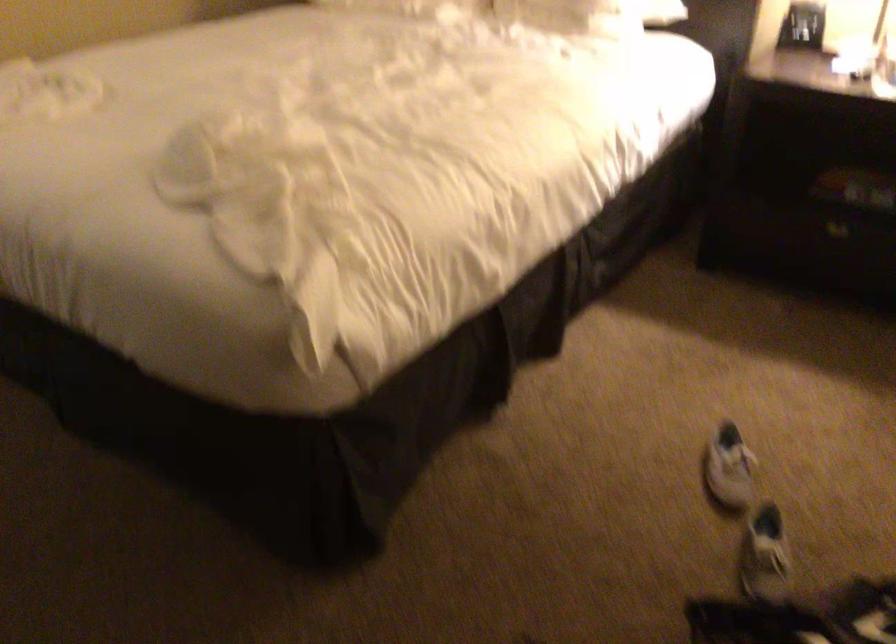
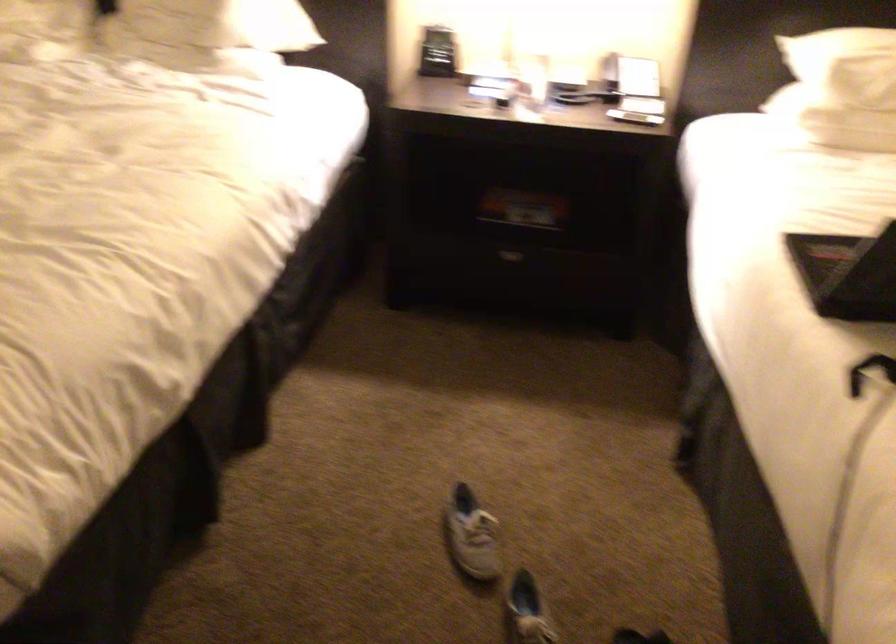
Where in the second image is the point corresponding to point 774,543 from the first image?

(528, 607)